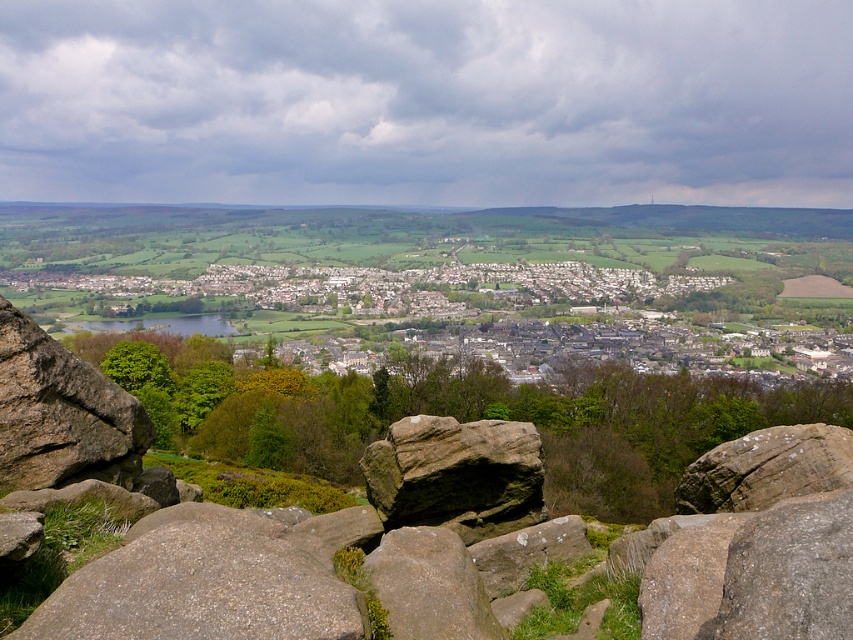
You are standing at the vantage point overlooking the valley. If you want to locate the white stone houses at center, which direction should you look relative to your position?

The white stone houses at center are located at coordinates point (479, 307), so you should look towards the center of the valley to find them.

You are a geologist examining the terrain from this vantage point. You see the brown rough rock at left and the gray rough rock at center. Which rock is taller?

The gray rough rock at center is taller than the brown rough rock at left.